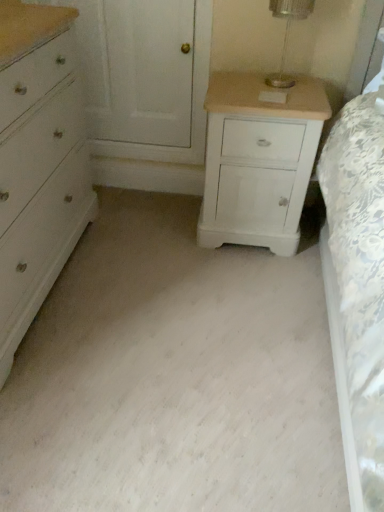
Question: From the image's perspective, relative to clear glass table lamp at upper center, is white painted wood nightstand at right above or below?

Choices:
 (A) below
 (B) above

Answer: (A)

Question: Which is correct: white painted wood nightstand at right is inside clear glass table lamp at upper center, or outside of it?

Choices:
 (A) outside
 (B) inside

Answer: (A)

Question: Which object is positioned farthest from the white painted wood chest of drawers at left?

Choices:
 (A) clear glass table lamp at upper center
 (B) white painted wood nightstand at right

Answer: (A)

Question: Estimate the real-world distances between objects in this image. Which object is farther from the white painted wood chest of drawers at left?

Choices:
 (A) white painted wood nightstand at right
 (B) clear glass table lamp at upper center

Answer: (B)